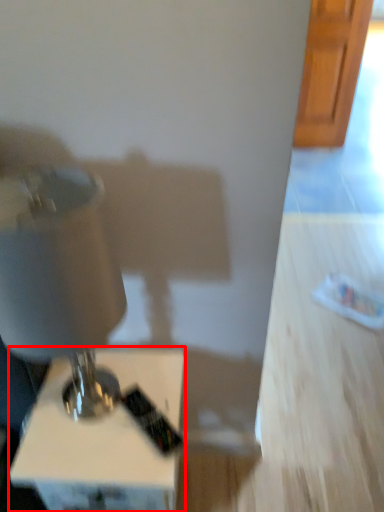
Question: From the image's perspective, what is the correct spatial relationship of furniture (annotated by the red box) in relation to sewing machine?

Choices:
 (A) above
 (B) below

Answer: (B)